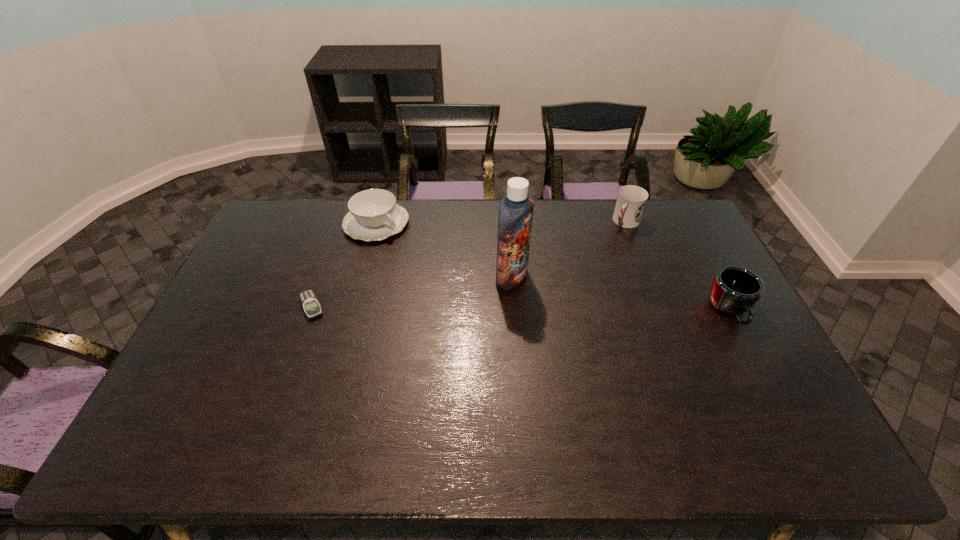
I want to click on free spot at the far edge of the desktop, so click(328, 227).

The width and height of the screenshot is (960, 540). What are the coordinates of `free region at the near edge` in the screenshot? It's located at (708, 394).

This screenshot has height=540, width=960. I want to click on vacant space at the left edge of the desktop, so click(x=271, y=302).

This screenshot has height=540, width=960. In the image, there is a desktop. Find the location of `vacant space at the right edge`. vacant space at the right edge is located at coordinates (745, 315).

Where is `vacant space at the far right corner`? The height and width of the screenshot is (540, 960). vacant space at the far right corner is located at coordinates (653, 216).

The image size is (960, 540). In order to click on vacant space that's between the shampoo and the rightmost object in this screenshot , I will do `click(620, 294)`.

You are a GUI agent. You are given a task and a screenshot of the screen. Output one action in this format:
    pyautogui.click(x=<x>, y=<y>)
    Task: Click on the vacant area that lies between the rightmost object and the chinaware
    Image resolution: width=960 pixels, height=540 pixels.
    Given the screenshot: What is the action you would take?
    pyautogui.click(x=553, y=267)

Locate an element on the screen. The height and width of the screenshot is (540, 960). free area in between the beeper and the tallest object is located at coordinates pos(412,292).

Image resolution: width=960 pixels, height=540 pixels. What are the coordinates of `empty space between the mug and the shortest object` in the screenshot? It's located at (520, 308).

Locate an element on the screen. This screenshot has width=960, height=540. free spot between the chinaware and the mug is located at coordinates (553, 267).